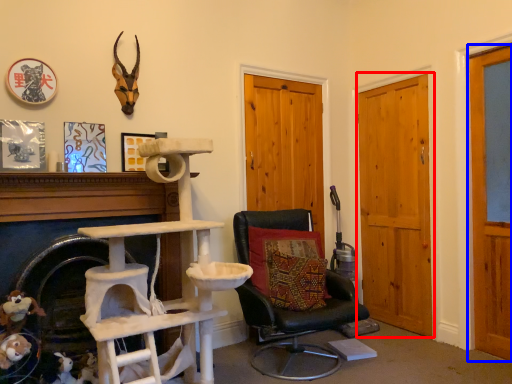
Question: Which of the following is the farthest to the observer, door (highlighted by a red box) or door (highlighted by a blue box)?

Choices:
 (A) door
 (B) door

Answer: (A)